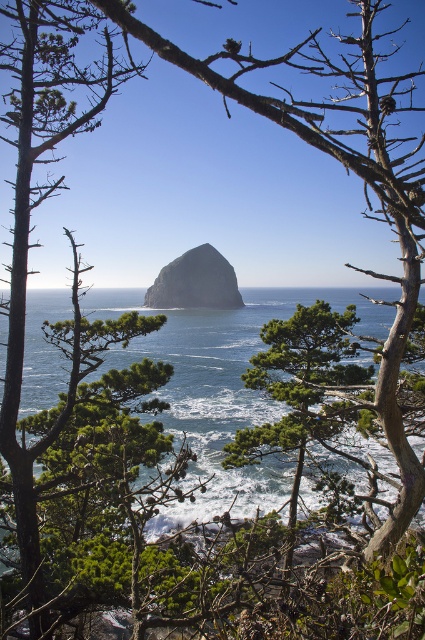
In the scene shown: You are a photographer planning to capture the Haystack Rock from the exact center of the image. According to the coordinates provided, where should you position your camera to ensure the blue water at center is in the frame?

The blue water at center is located at coordinates point (x=221, y=380), so positioning the camera at that point will ensure it is centered in the frame.

You are standing at the viewpoint overlooking Haystack Rock. You notice two points marked on the landscape. The first point is at coordinates point [87,312], and the second is at point [167,301]. Which point is nearer to your current position?

Point [87,312] is closer to the viewer than point [167,301].